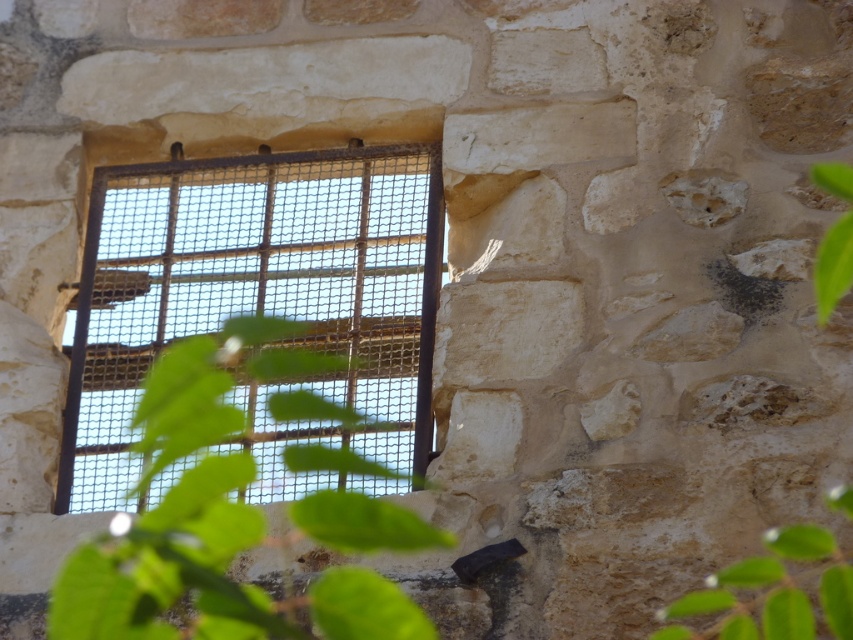
Question: Which point is closer to the camera?

Choices:
 (A) green leafy plant at upper right
 (B) green leafy plant at center

Answer: (B)

Question: Which is farther from the green leafy plant at center?

Choices:
 (A) green leafy plant at lower right
 (B) green leafy plant at upper right
 (C) rusty metal grid at center

Answer: (B)

Question: From the image, what is the correct spatial relationship of green leafy plant at center in relation to green leafy plant at lower right?

Choices:
 (A) left
 (B) right

Answer: (A)

Question: Which point appears closest to the camera in this image?

Choices:
 (A) [322, 236]
 (B) [721, 586]
 (C) [820, 323]
 (D) [183, 554]

Answer: (B)

Question: Is rusty metal grid at center closer to camera compared to green leafy plant at upper right?

Choices:
 (A) yes
 (B) no

Answer: (A)

Question: Is rusty metal grid at center thinner than green leafy plant at center?

Choices:
 (A) no
 (B) yes

Answer: (A)